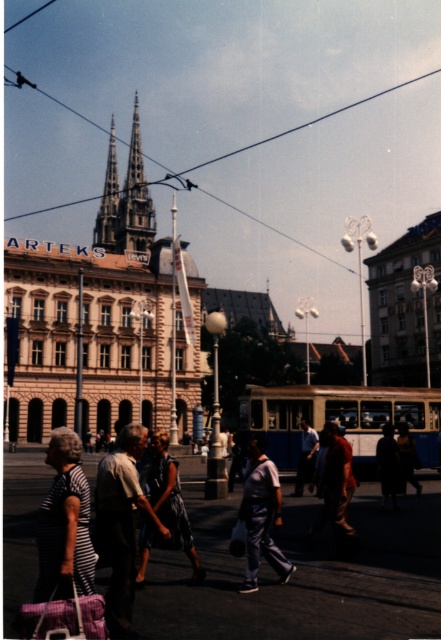
In the scene shown: You are a photographer planning to take a photo of the historic building with its two spires. You notice two dresses in the foreground that might distract from the building. The striped fabric dress at lower left and the blue denim dress at center. Which dress is wider and might block more of the building in your photo?

The striped fabric dress at lower left is wider than the blue denim dress at center, so it might block more of the building in your photo.

You are a photographer trying to capture a photo of the historic building with the two spires. You notice the striped fabric people at center and the dark fabric bag at lower right in your frame. Since you want to focus on the building, which object should you avoid blocking the view of the spires?

The striped fabric people at center is bigger than the dark fabric bag at lower right, so you should avoid blocking the striped fabric people at center as it is larger and would more obstruct the view of the spires.